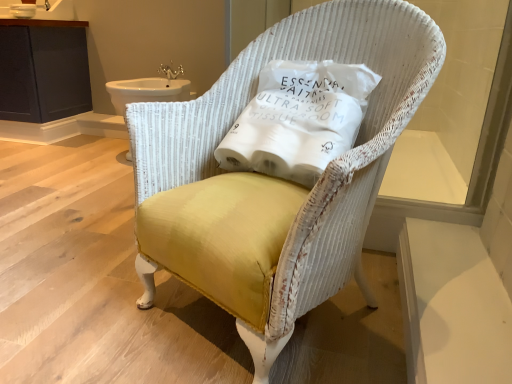
You are a GUI agent. You are given a task and a screenshot of the screen. Output one action in this format:
    pyautogui.click(x=<x>, y=<y>)
    Task: Click on the free space that is to the left of yellow fabric chair at center
    The height and width of the screenshot is (384, 512).
    Given the screenshot: What is the action you would take?
    pyautogui.click(x=80, y=281)